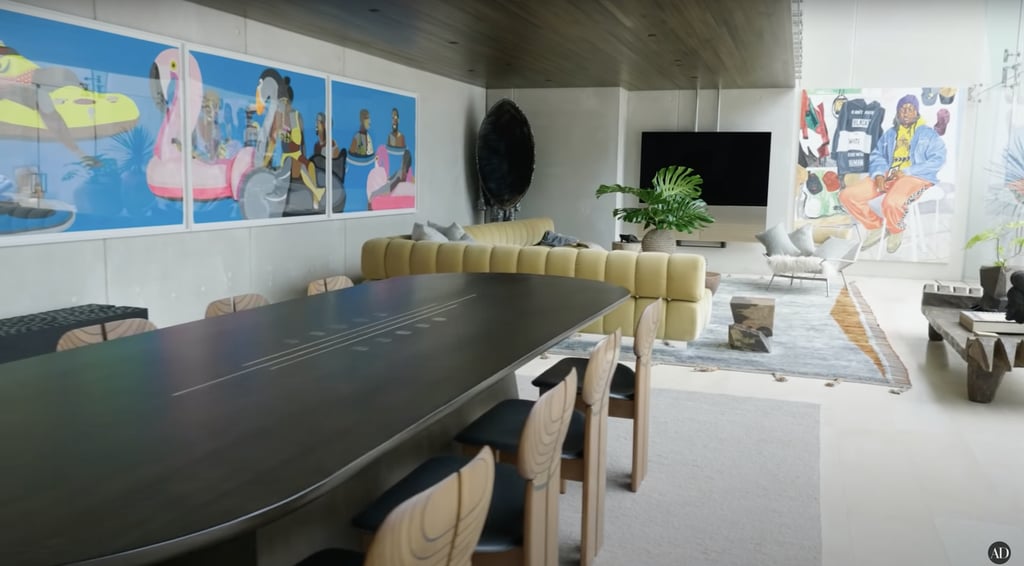
In order to click on cushions in this screenshot , I will do `click(446, 231)`, `click(427, 237)`, `click(557, 237)`, `click(775, 251)`, `click(800, 240)`.